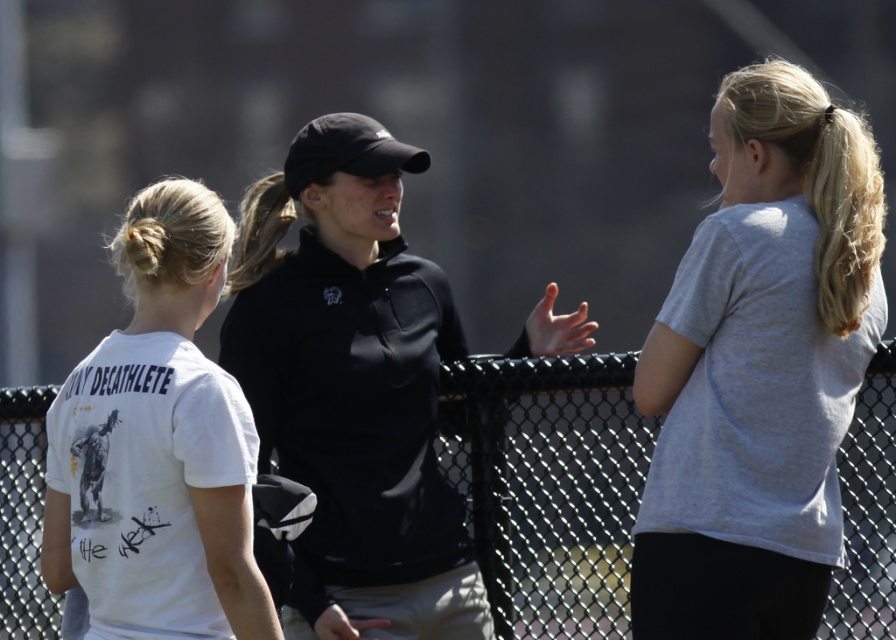
You are standing at the point with coordinates point (171, 253) and want to move to the point with coordinates point (464, 424). Which direction should you move in to get closer to the camera?

You should move towards point (464, 424) because it is further to the camera than point (171, 253).